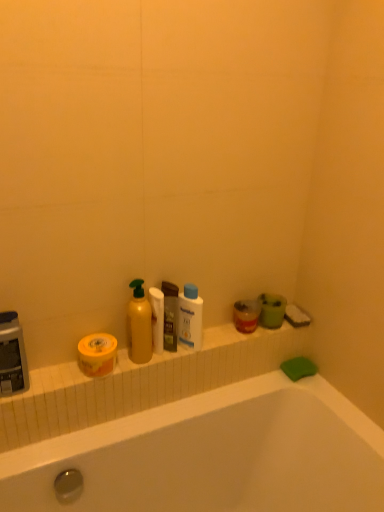
At what (x,y) coordinates should I click in order to perform the action: click on vacant area located to the right-hand side of white plastic bottle at center, arranged as the 2th cleaning product when viewed from the left. Please return your answer as a coordinate pair (x, y). Image resolution: width=384 pixels, height=512 pixels. Looking at the image, I should click on (222, 342).